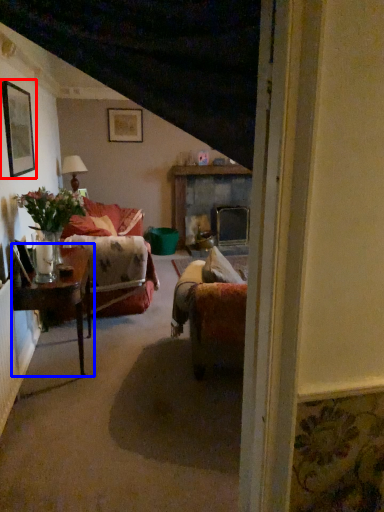
Question: Which object is further to the camera taking this photo, picture frame (highlighted by a red box) or table (highlighted by a blue box)?

Choices:
 (A) picture frame
 (B) table

Answer: (A)